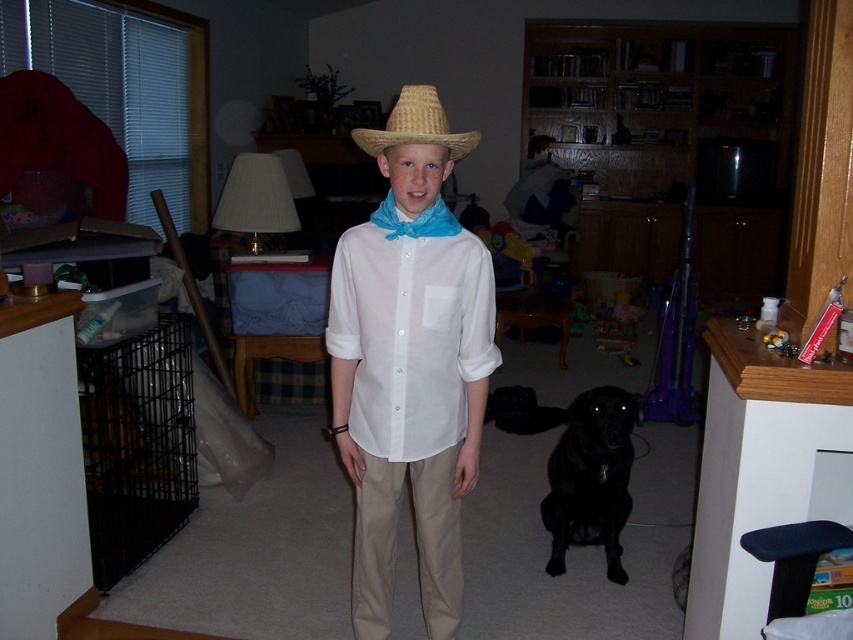
Question: Does khaki cotton pants at center appear under strawmaterial/texturecowboy hat at center?

Choices:
 (A) yes
 (B) no

Answer: (A)

Question: Does khaki cotton pants at center have a smaller size compared to black glossy dog at lower center?

Choices:
 (A) yes
 (B) no

Answer: (A)

Question: Which object is closer to the camera taking this photo?

Choices:
 (A) khaki cotton pants at center
 (B) black glossy dog at lower center
 (C) white sheer shirt at center

Answer: (C)

Question: Does white sheer shirt at center have a larger size compared to khaki cotton pants at center?

Choices:
 (A) no
 (B) yes

Answer: (A)

Question: Based on their relative distances, which object is farther from the khaki cotton pants at center?

Choices:
 (A) white sheer shirt at center
 (B) black glossy dog at lower center
 (C) white cotton shirt at center

Answer: (B)

Question: Which object is farther from the camera taking this photo?

Choices:
 (A) white sheer shirt at center
 (B) white cotton shirt at center
 (C) strawmaterial/texturecowboy hat at center
 (D) black glossy dog at lower center

Answer: (D)